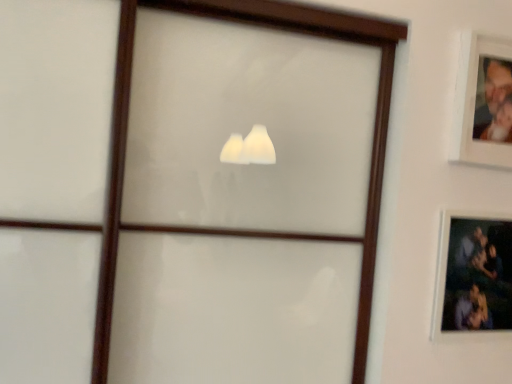
The height and width of the screenshot is (384, 512). Describe the element at coordinates (483, 102) in the screenshot. I see `white matte picture frame at upper right, which is the 1th picture frame from top to bottom` at that location.

This screenshot has height=384, width=512. I want to click on white matte picture frame at upper right, which is the 1th picture frame from top to bottom, so click(x=483, y=102).

What do you see at coordinates (473, 278) in the screenshot?
I see `matte black picture frame at upper right, which ranks as the first picture frame in bottom-to-top order` at bounding box center [473, 278].

How much space does matte black picture frame at upper right, which ranks as the first picture frame in bottom-to-top order, occupy vertically?

The height of matte black picture frame at upper right, which ranks as the first picture frame in bottom-to-top order, is 13.46 inches.

This screenshot has width=512, height=384. I want to click on matte black picture frame at upper right, the second picture frame from the top, so click(x=473, y=278).

The image size is (512, 384). In order to click on white matte picture frame at upper right, marked as the second picture frame in a bottom-to-top arrangement in this screenshot , I will do `click(483, 102)`.

Which object is positioned more to the left, matte black picture frame at upper right, which ranks as the first picture frame in bottom-to-top order, or white matte picture frame at upper right, which is the 1th picture frame from top to bottom?

Positioned to the left is matte black picture frame at upper right, which ranks as the first picture frame in bottom-to-top order.

Which is behind, matte black picture frame at upper right, which ranks as the first picture frame in bottom-to-top order, or white matte picture frame at upper right, marked as the second picture frame in a bottom-to-top arrangement?

Positioned behind is matte black picture frame at upper right, which ranks as the first picture frame in bottom-to-top order.

Considering the positions of point (447, 231) and point (503, 62), is point (447, 231) closer or farther from the camera than point (503, 62)?

Point (447, 231) is farther from the camera than point (503, 62).

From the image's perspective, is matte black picture frame at upper right, the second picture frame from the top, on white matte picture frame at upper right, marked as the second picture frame in a bottom-to-top arrangement?

No.

From a real-world perspective, relative to white matte picture frame at upper right, which is the 1th picture frame from top to bottom, is matte black picture frame at upper right, which ranks as the first picture frame in bottom-to-top order, vertically above or below?

From a real-world perspective, matte black picture frame at upper right, which ranks as the first picture frame in bottom-to-top order, is physically below white matte picture frame at upper right, which is the 1th picture frame from top to bottom.

Between matte black picture frame at upper right, the second picture frame from the top, and white matte picture frame at upper right, marked as the second picture frame in a bottom-to-top arrangement, which one has larger width?

matte black picture frame at upper right, the second picture frame from the top.

Which of these two, matte black picture frame at upper right, the second picture frame from the top, or white matte picture frame at upper right, marked as the second picture frame in a bottom-to-top arrangement, stands taller?

With more height is matte black picture frame at upper right, the second picture frame from the top.

Between matte black picture frame at upper right, which ranks as the first picture frame in bottom-to-top order, and white matte picture frame at upper right, which is the 1th picture frame from top to bottom, which one has larger size?

matte black picture frame at upper right, which ranks as the first picture frame in bottom-to-top order, is bigger.

Choose the correct answer: Is matte black picture frame at upper right, the second picture frame from the top, inside white matte picture frame at upper right, which is the 1th picture frame from top to bottom, or outside it?

matte black picture frame at upper right, the second picture frame from the top, is spatially situated outside white matte picture frame at upper right, which is the 1th picture frame from top to bottom.

Is matte black picture frame at upper right, which ranks as the first picture frame in bottom-to-top order, placed right next to white matte picture frame at upper right, marked as the second picture frame in a bottom-to-top arrangement?

No, matte black picture frame at upper right, which ranks as the first picture frame in bottom-to-top order, is not in contact with white matte picture frame at upper right, marked as the second picture frame in a bottom-to-top arrangement.

Is matte black picture frame at upper right, which ranks as the first picture frame in bottom-to-top order, looking in the opposite direction of white matte picture frame at upper right, which is the 1th picture frame from top to bottom?

matte black picture frame at upper right, which ranks as the first picture frame in bottom-to-top order, is not turned away from white matte picture frame at upper right, which is the 1th picture frame from top to bottom.

Can you tell me how much matte black picture frame at upper right, which ranks as the first picture frame in bottom-to-top order, and white matte picture frame at upper right, marked as the second picture frame in a bottom-to-top arrangement, differ in facing direction?

They differ by 0.00514 degrees in their facing directions.

How distant is matte black picture frame at upper right, which ranks as the first picture frame in bottom-to-top order, from white matte picture frame at upper right, which is the 1th picture frame from top to bottom?

11.37 inches.

The image size is (512, 384). Identify the location of picture frame directly beneath the white matte picture frame at upper right, which is the 1th picture frame from top to bottom (from a real-world perspective). (473, 278).

Visually, is white matte picture frame at upper right, marked as the second picture frame in a bottom-to-top arrangement, positioned to the left or to the right of matte black picture frame at upper right, the second picture frame from the top?

Clearly, white matte picture frame at upper right, marked as the second picture frame in a bottom-to-top arrangement, is on the right of matte black picture frame at upper right, the second picture frame from the top, in the image.

Which is behind, white matte picture frame at upper right, which is the 1th picture frame from top to bottom, or matte black picture frame at upper right, which ranks as the first picture frame in bottom-to-top order?

matte black picture frame at upper right, which ranks as the first picture frame in bottom-to-top order, is further from the camera.

Which is closer, (479,88) or (472,298)?

Point (479,88) is positioned closer to the camera compared to point (472,298).

From the image's perspective, which is below, white matte picture frame at upper right, which is the 1th picture frame from top to bottom, or matte black picture frame at upper right, which ranks as the first picture frame in bottom-to-top order?

matte black picture frame at upper right, which ranks as the first picture frame in bottom-to-top order, is shown below in the image.

From a real-world perspective, does white matte picture frame at upper right, marked as the second picture frame in a bottom-to-top arrangement, stand above matte black picture frame at upper right, which ranks as the first picture frame in bottom-to-top order?

Indeed, from a real-world perspective, white matte picture frame at upper right, marked as the second picture frame in a bottom-to-top arrangement, stands above matte black picture frame at upper right, which ranks as the first picture frame in bottom-to-top order.

Looking at their sizes, would you say white matte picture frame at upper right, marked as the second picture frame in a bottom-to-top arrangement, is wider or thinner than matte black picture frame at upper right, the second picture frame from the top?

white matte picture frame at upper right, marked as the second picture frame in a bottom-to-top arrangement, is thinner than matte black picture frame at upper right, the second picture frame from the top.

Does white matte picture frame at upper right, which is the 1th picture frame from top to bottom, have a greater height compared to matte black picture frame at upper right, which ranks as the first picture frame in bottom-to-top order?

In fact, white matte picture frame at upper right, which is the 1th picture frame from top to bottom, may be shorter than matte black picture frame at upper right, which ranks as the first picture frame in bottom-to-top order.

Who is bigger, white matte picture frame at upper right, marked as the second picture frame in a bottom-to-top arrangement, or matte black picture frame at upper right, the second picture frame from the top?

With larger size is matte black picture frame at upper right, the second picture frame from the top.

Is matte black picture frame at upper right, which ranks as the first picture frame in bottom-to-top order, located within white matte picture frame at upper right, which is the 1th picture frame from top to bottom?

No.

Based on the photo, are white matte picture frame at upper right, which is the 1th picture frame from top to bottom, and matte black picture frame at upper right, which ranks as the first picture frame in bottom-to-top order, located far from each other?

No.

Is matte black picture frame at upper right, which ranks as the first picture frame in bottom-to-top order, at the back of white matte picture frame at upper right, marked as the second picture frame in a bottom-to-top arrangement?

No, white matte picture frame at upper right, marked as the second picture frame in a bottom-to-top arrangement, is not facing the opposite direction of matte black picture frame at upper right, which ranks as the first picture frame in bottom-to-top order.

What's the angular difference between white matte picture frame at upper right, which is the 1th picture frame from top to bottom, and matte black picture frame at upper right, the second picture frame from the top,'s facing directions?

There is a 0.00514-degree angle between the facing directions of white matte picture frame at upper right, which is the 1th picture frame from top to bottom, and matte black picture frame at upper right, the second picture frame from the top.

How far apart are white matte picture frame at upper right, which is the 1th picture frame from top to bottom, and matte black picture frame at upper right, which ranks as the first picture frame in bottom-to-top order?

white matte picture frame at upper right, which is the 1th picture frame from top to bottom, is 11.37 inches away from matte black picture frame at upper right, which ranks as the first picture frame in bottom-to-top order.

This screenshot has height=384, width=512. Find the location of `picture frame behind the white matte picture frame at upper right, marked as the second picture frame in a bottom-to-top arrangement`. picture frame behind the white matte picture frame at upper right, marked as the second picture frame in a bottom-to-top arrangement is located at coordinates (473, 278).

Locate an element on the screen. picture frame below the white matte picture frame at upper right, which is the 1th picture frame from top to bottom (from a real-world perspective) is located at coordinates (473, 278).

Locate an element on the screen. picture frame lying on the right of matte black picture frame at upper right, the second picture frame from the top is located at coordinates (483, 102).